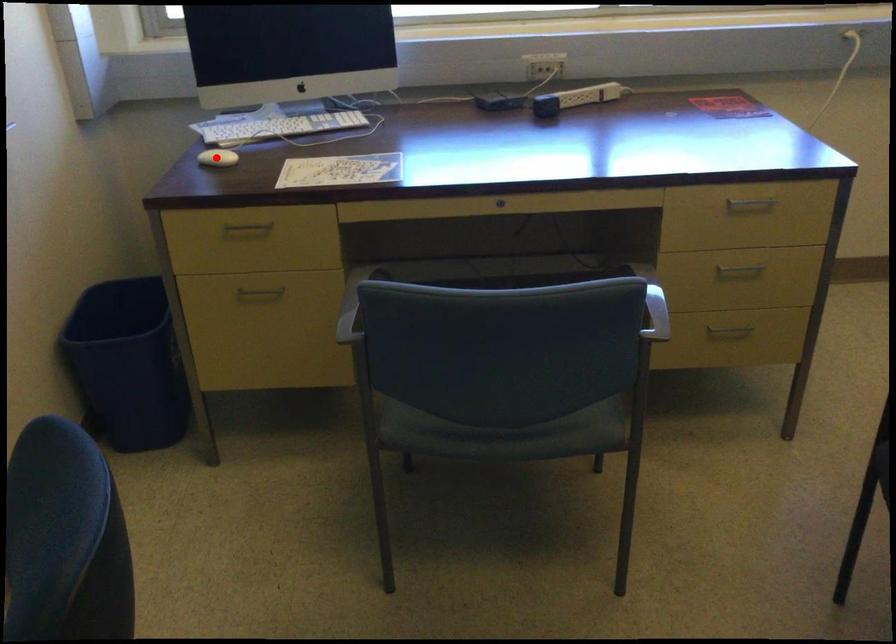
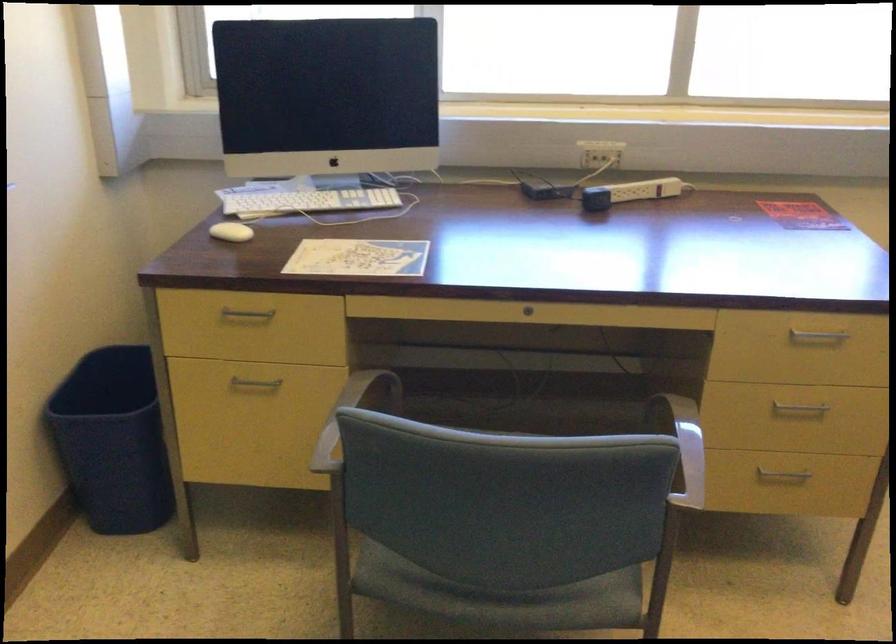
Where in the second image is the point corresponding to the highlighted location from the first image?

(230, 232)